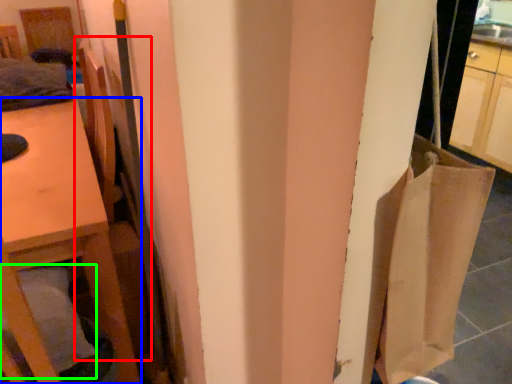
Question: Considering the real-world distances, which object is closest to chair (highlighted by a red box)? furniture (highlighted by a blue box) or pillow (highlighted by a green box).

Choices:
 (A) furniture
 (B) pillow

Answer: (A)